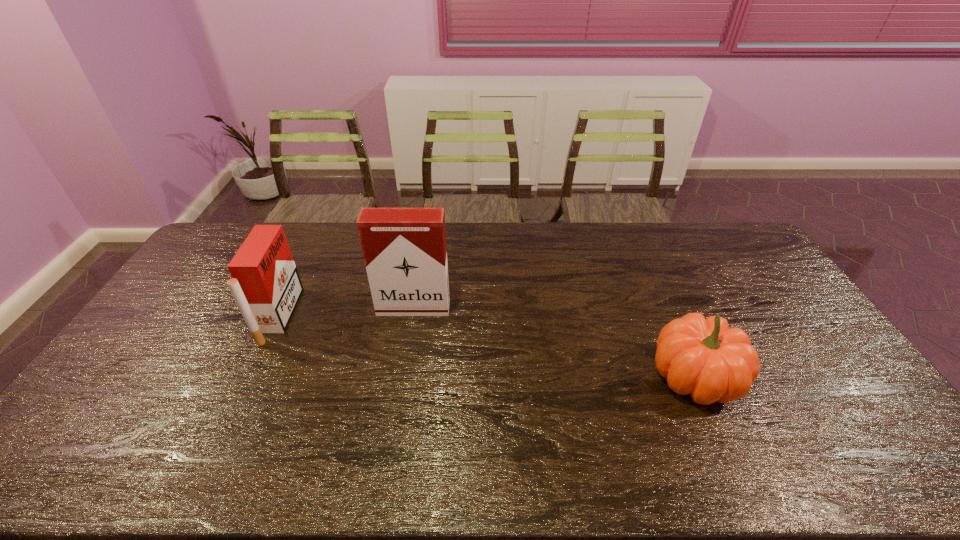
In order to click on free space in the image that satisfies the following two spatial constraints: 1. on the front-facing side of the left cigarette case; 2. on the right side of the pumpkin in this screenshot , I will do `click(251, 377)`.

Identify the location of vacant space that satisfies the following two spatial constraints: 1. on the front-facing side of the pumpkin; 2. on the left side of the left cigarette case. The image size is (960, 540). (251, 377).

At what (x,y) coordinates should I click in order to perform the action: click on vacant space that satisfies the following two spatial constraints: 1. on the front-facing side of the second object from right to left; 2. on the front-facing side of the leftmost object. Please return your answer as a coordinate pair (x, y). This screenshot has width=960, height=540. Looking at the image, I should click on (412, 316).

The width and height of the screenshot is (960, 540). In order to click on vacant space that satisfies the following two spatial constraints: 1. on the front-facing side of the shorter cigarette case; 2. on the back side of the shortest object in this screenshot , I will do `click(251, 377)`.

Locate an element on the screen. Image resolution: width=960 pixels, height=540 pixels. free location that satisfies the following two spatial constraints: 1. on the front-facing side of the rightmost object; 2. on the right side of the taller cigarette case is located at coordinates (402, 377).

The height and width of the screenshot is (540, 960). Identify the location of free location that satisfies the following two spatial constraints: 1. on the front-facing side of the taller cigarette case; 2. on the front-facing side of the shorter cigarette case. coord(412,316).

At what (x,y) coordinates should I click in order to perform the action: click on vacant space that satisfies the following two spatial constraints: 1. on the back side of the shortest object; 2. on the front-facing side of the left cigarette case. Please return your answer as a coordinate pair (x, y). This screenshot has width=960, height=540. Looking at the image, I should click on (667, 316).